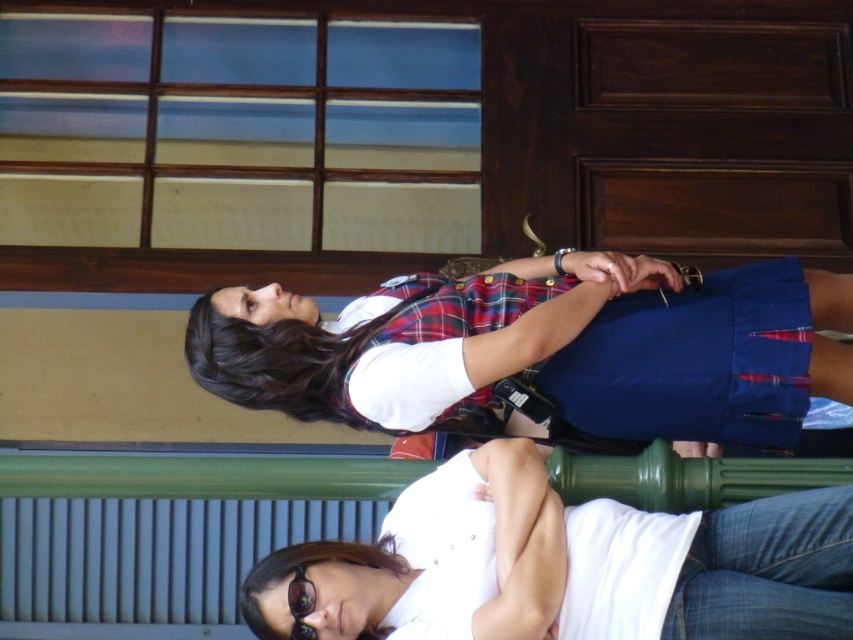
In the scene shown: Is matte plaid vest at center further to camera compared to white cotton shirt at center?

Yes, it is behind white cotton shirt at center.

Based on the photo, measure the distance between matte plaid vest at center and camera.

matte plaid vest at center and camera are 4.20 meters apart from each other.

In order to click on matte plaid vest at center in this screenshot , I will do tap(543, 348).

Between point (590, 324) and point (289, 605), which one is positioned in front?

Point (289, 605) is in front.

Can you confirm if matte plaid vest at center is positioned to the right of translucent plastic goggles at lower center?

Correct, you'll find matte plaid vest at center to the right of translucent plastic goggles at lower center.

Is point (309, 353) positioned behind point (309, 602)?

Yes, point (309, 353) is behind point (309, 602).

Where is `matte plaid vest at center`? This screenshot has width=853, height=640. matte plaid vest at center is located at coordinates (543, 348).

Who is lower down, white cotton shirt at center or translucent plastic goggles at lower center?

translucent plastic goggles at lower center is lower down.

Between point (285, 609) and point (305, 570), which one is positioned behind?

The point (305, 570) is behind.

Identify the location of white cotton shirt at center. (566, 557).